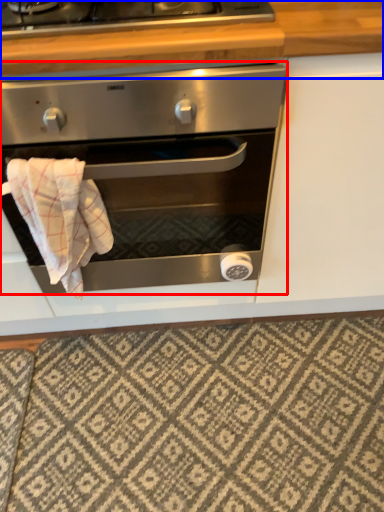
Question: Which object is further to the camera taking this photo, oven (highlighted by a red box) or counter top (highlighted by a blue box)?

Choices:
 (A) oven
 (B) counter top

Answer: (B)